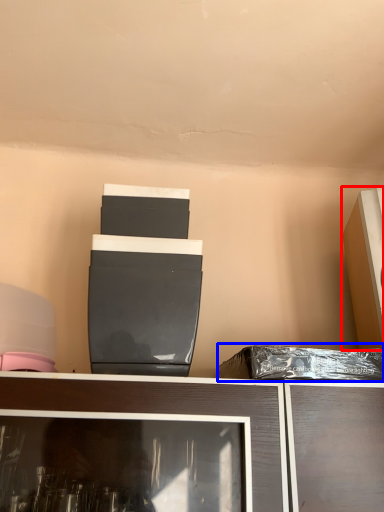
Question: Which object appears farthest to the camera in this image, appliance (highlighted by a red box) or garbage (highlighted by a blue box)?

Choices:
 (A) appliance
 (B) garbage

Answer: (A)